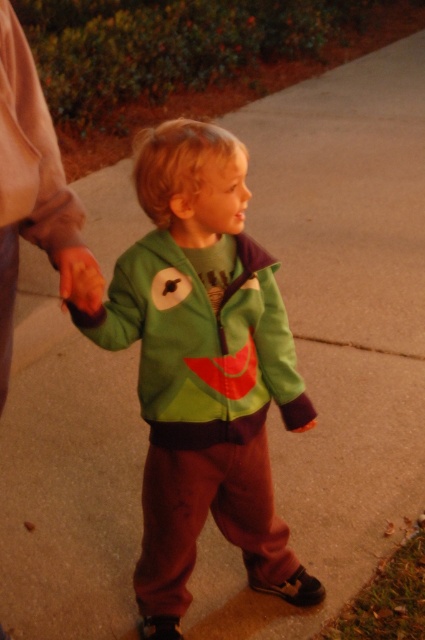
You are a photographer trying to capture a closeup of the green soft jacket at center and the smooth orange hand at lower left in the image. Given that your camera can only focus on objects within 30 centimeters of each other, will you be able to get both in focus?

The green soft jacket at center and smooth orange hand at lower left are 33.31 centimeters apart from each other. Since the distance between them exceeds the camera focus range of 30 centimeters, the photographer cannot get both in focus.

You are a costume designer trying to decide which jacket to use for a performance. The green matte jacket at center and the green soft jacket at center are both options. Based on the image, which jacket is wider?

The green matte jacket at center is wider than the green soft jacket at center according to the description.